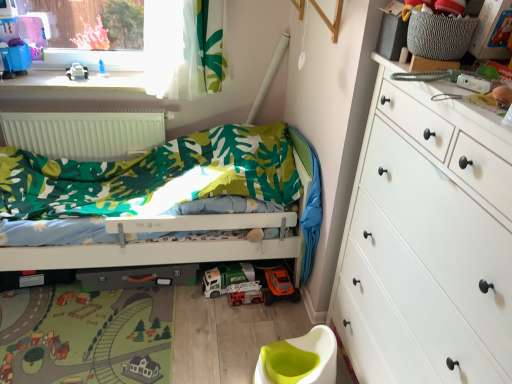
You are a GUI agent. You are given a task and a screenshot of the screen. Output one action in this format:
    pyautogui.click(x=<x>, y=<y>)
    Task: Click on the vacant space situated above white plastic toy car at upper left (from a real-world perspective)
    
    Given the screenshot: What is the action you would take?
    pyautogui.click(x=70, y=76)